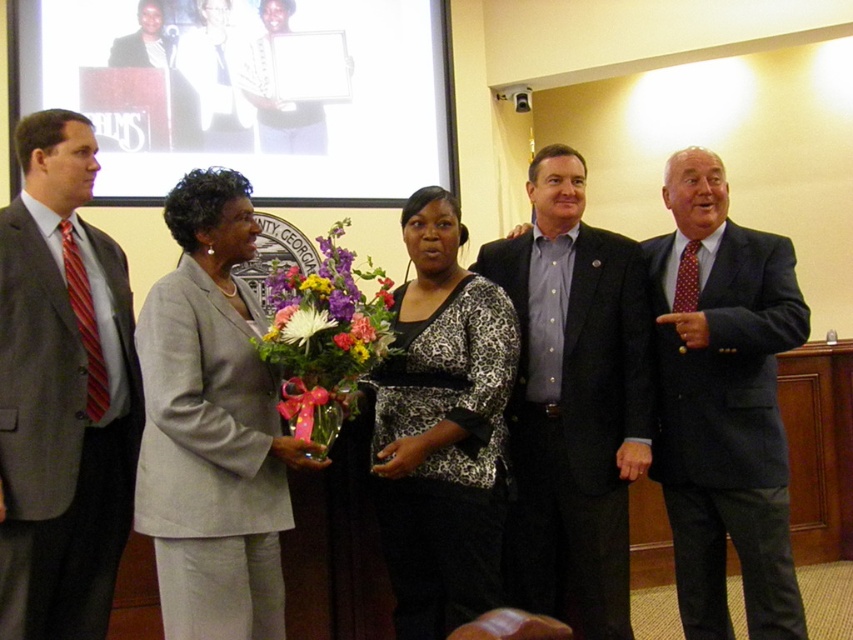
Looking at this image, is dark blue suit at right bigger than leopard print blouse at center?

Actually, dark blue suit at right might be smaller than leopard print blouse at center.

Is point (767, 300) closer to viewer compared to point (439, 529)?

No, it is not.

Does point (659, 362) come behind point (402, 296)?

Yes, point (659, 362) is farther from viewer.

This screenshot has width=853, height=640. I want to click on dark blue suit at right, so click(723, 403).

Consider the image. Is light gray suit at center positioned at the back of vibrant floral bouquet at center?

No, light gray suit at center is in front of vibrant floral bouquet at center.

Between light gray suit at center and vibrant floral bouquet at center, which one is positioned higher?

vibrant floral bouquet at center

Is point (231, 582) positioned before point (293, 284)?

Yes, it is in front of point (293, 284).

Where is `light gray suit at center`? light gray suit at center is located at coordinates (212, 426).

Does light gray suit at center have a lesser width compared to dark blue suit at center?

Yes, light gray suit at center is thinner than dark blue suit at center.

Which of these two, light gray suit at center or dark blue suit at center, stands taller?

Standing taller between the two is dark blue suit at center.

Is point (158, 339) less distant than point (537, 163)?

Yes.

Where is `light gray suit at center`? light gray suit at center is located at coordinates tap(212, 426).